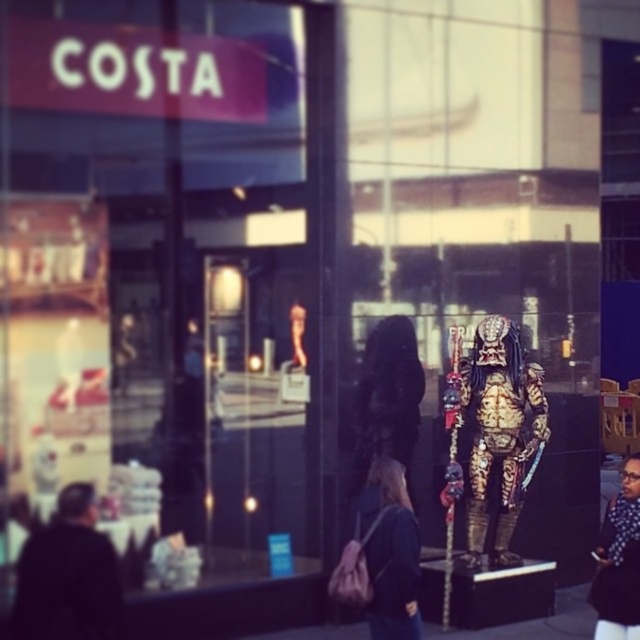
You are a delivery person who needs to place a package between the matte black jacket at center and the dark blue fabric jacket at lower right. The package is 4 feet long. Will it fit in the space between them?

The distance between the matte black jacket at center and the dark blue fabric jacket at lower right is 3.96 feet. Since the package is 4 feet long, it will not fit in the space between them as the package is slightly longer than the available distance.

You are a delivery person who needs to place a dark blue fabric jacket at lower right next to the gold metallic predator at center. Given that the distance between them is 6.02 feet, is this placement possible if your delivery cart is 5 feet wide?

The gold metallic predator at center and dark blue fabric jacket at lower right are 6.02 feet apart. Since the delivery cart is 5 feet wide, the jacket can be placed next to the predator as there is enough space between them.